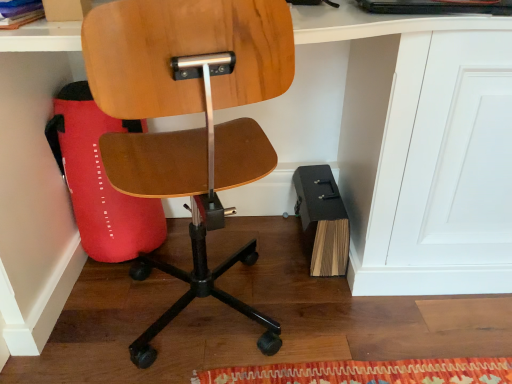
What are the coordinates of `vacant area situated below wooden chair at center (from a real-world perspective)` in the screenshot? It's located at (211, 311).